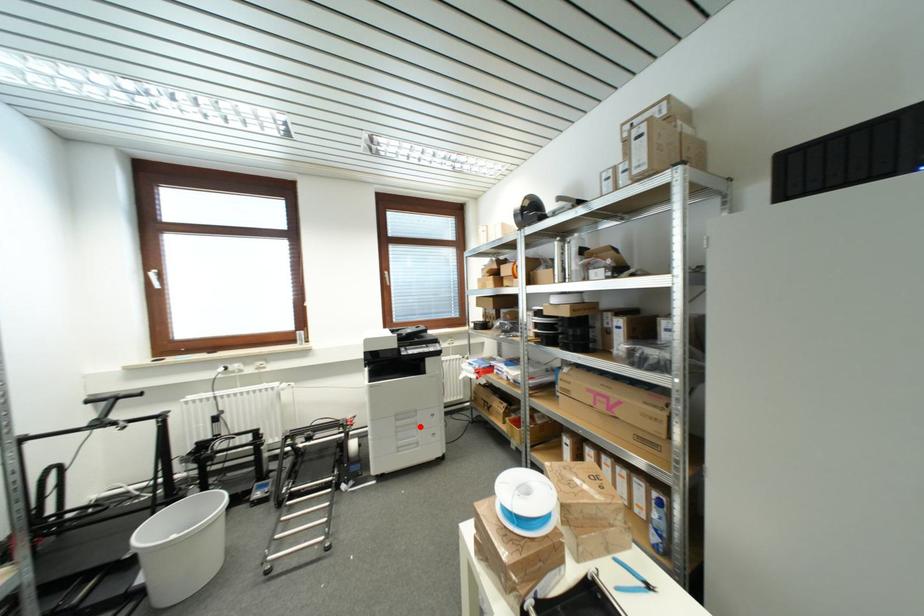
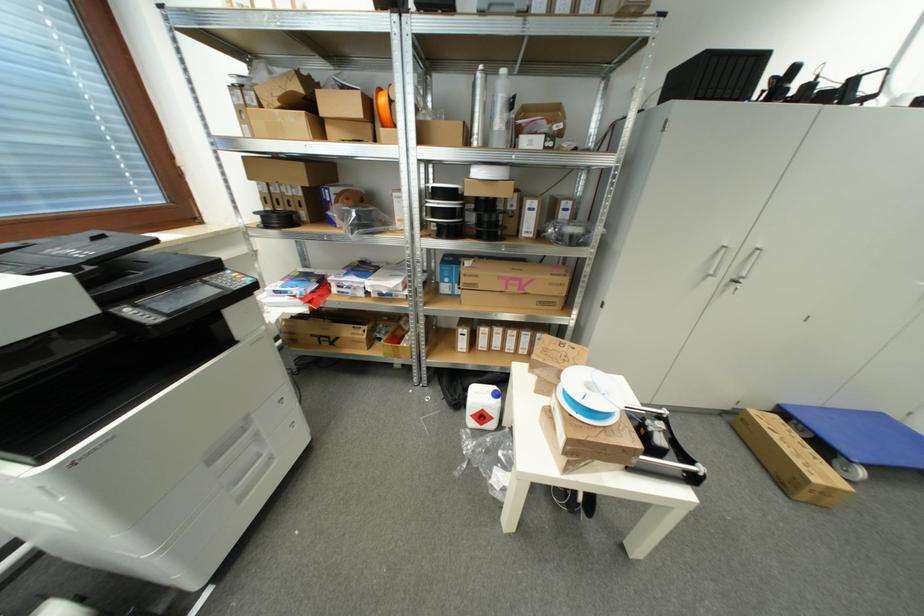
Question: I am providing you with two images of the same scene from different viewpoints. A red point is marked on the first image. Can you still see the location of the red point in image 2?

Choices:
 (A) Yes
 (B) No

Answer: (A)